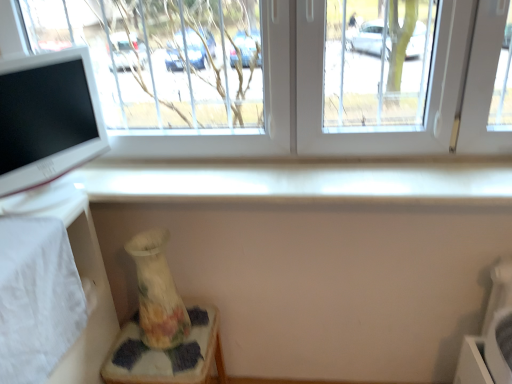
Question: Is white glossy computer monitor at left shorter than white fabric table at lower left?

Choices:
 (A) no
 (B) yes

Answer: (B)

Question: Would you say white glossy computer monitor at left contains white fabric table at lower left?

Choices:
 (A) yes
 (B) no

Answer: (B)

Question: Considering the relative positions of white glossy computer monitor at left and white fabric table at lower left in the image provided, is white glossy computer monitor at left to the left of white fabric table at lower left from the viewer's perspective?

Choices:
 (A) yes
 (B) no

Answer: (B)

Question: From a real-world perspective, is white glossy computer monitor at left over white fabric table at lower left?

Choices:
 (A) no
 (B) yes

Answer: (B)

Question: From the image's perspective, is white glossy computer monitor at left located beneath white fabric table at lower left?

Choices:
 (A) no
 (B) yes

Answer: (A)

Question: Looking at the image, does transparent glass window at upper center seem bigger or smaller compared to porcelain floral vase at lower left?

Choices:
 (A) big
 (B) small

Answer: (A)

Question: From a real-world perspective, is transparent glass window at upper center above or below porcelain floral vase at lower left?

Choices:
 (A) below
 (B) above

Answer: (B)

Question: Looking at their shapes, would you say transparent glass window at upper center is wider or thinner than porcelain floral vase at lower left?

Choices:
 (A) thin
 (B) wide

Answer: (A)

Question: Considering the positions of transparent glass window at upper center and porcelain floral vase at lower left in the image, is transparent glass window at upper center taller or shorter than porcelain floral vase at lower left?

Choices:
 (A) tall
 (B) short

Answer: (A)

Question: From the image's perspective, relative to white fabric table at lower left, is porcelain floral vase at lower left above or below?

Choices:
 (A) below
 (B) above

Answer: (A)

Question: Does point (104, 379) appear closer or farther from the camera than point (42, 196)?

Choices:
 (A) closer
 (B) farther

Answer: (B)

Question: Would you say porcelain floral vase at lower left is to the left or to the right of white fabric table at lower left in the picture?

Choices:
 (A) right
 (B) left

Answer: (A)

Question: Looking at the image, does porcelain floral vase at lower left seem bigger or smaller compared to white fabric table at lower left?

Choices:
 (A) big
 (B) small

Answer: (B)

Question: In terms of width, does transparent glass window at upper center look wider or thinner when compared to floral-patterned ceramic vase at lower left?

Choices:
 (A) thin
 (B) wide

Answer: (B)

Question: In the image, is transparent glass window at upper center positioned in front of or behind floral-patterned ceramic vase at lower left?

Choices:
 (A) front
 (B) behind

Answer: (A)